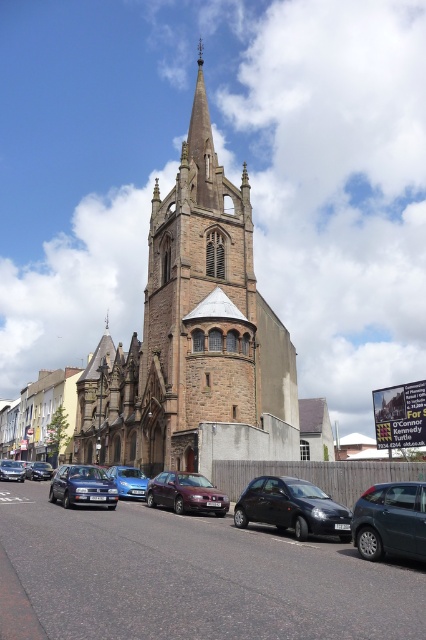
Question: Is blue metallic hatchback at center thinner than matte black car at center?

Choices:
 (A) yes
 (B) no

Answer: (A)

Question: Which point is farther to the camera?

Choices:
 (A) satin burgundy sedan at center
 (B) matte black car at center

Answer: (B)

Question: Can you confirm if satin burgundy sedan at center is positioned below metallic blue sedan at lower left?

Choices:
 (A) no
 (B) yes

Answer: (A)

Question: Which point is farther from the camera taking this photo?

Choices:
 (A) (143, 486)
 (B) (365, 536)
 (C) (28, 474)
 (D) (25, 477)

Answer: (C)

Question: Which of the following is the farthest from the observer?

Choices:
 (A) shiny black hatchback at center
 (B) blue metallic hatchback at center
 (C) satin burgundy sedan at center
 (D) metallic gray hatchback at lower right

Answer: (B)

Question: Considering the relative positions of metallic blue sedan at lower left and blue metallic hatchback at center in the image provided, where is metallic blue sedan at lower left located with respect to blue metallic hatchback at center?

Choices:
 (A) left
 (B) right

Answer: (A)